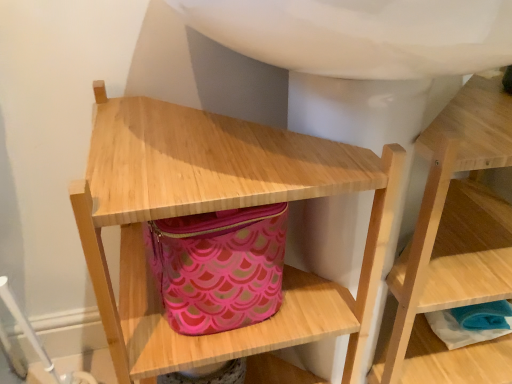
Question: Considering the relative positions of natural wood shelf at center, which ranks as the 1th shelf in left-to-right order, and wooden shelf at center, which appears as the first shelf when viewed from the right, in the image provided, is natural wood shelf at center, which ranks as the 1th shelf in left-to-right order, to the right of wooden shelf at center, which appears as the first shelf when viewed from the right, from the viewer's perspective?

Choices:
 (A) yes
 (B) no

Answer: (B)

Question: From a real-world perspective, is natural wood shelf at center, which appears as the 2th shelf when viewed from the right, over wooden shelf at center, positioned as the second shelf in left-to-right order?

Choices:
 (A) yes
 (B) no

Answer: (A)

Question: Does natural wood shelf at center, which ranks as the 1th shelf in left-to-right order, have a smaller size compared to wooden shelf at center, positioned as the second shelf in left-to-right order?

Choices:
 (A) no
 (B) yes

Answer: (A)

Question: From the image's perspective, is natural wood shelf at center, which appears as the 2th shelf when viewed from the right, on wooden shelf at center, which appears as the first shelf when viewed from the right?

Choices:
 (A) no
 (B) yes

Answer: (A)

Question: Are natural wood shelf at center, which appears as the 2th shelf when viewed from the right, and wooden shelf at center, positioned as the second shelf in left-to-right order, far apart?

Choices:
 (A) no
 (B) yes

Answer: (A)

Question: Is wooden shelf at center, which appears as the first shelf when viewed from the right, taller or shorter than natural wood shelf at center, which appears as the 2th shelf when viewed from the right?

Choices:
 (A) short
 (B) tall

Answer: (A)

Question: Looking at the image, does wooden shelf at center, positioned as the second shelf in left-to-right order, seem bigger or smaller compared to natural wood shelf at center, which appears as the 2th shelf when viewed from the right?

Choices:
 (A) small
 (B) big

Answer: (A)

Question: Considering the positions of point (392, 288) and point (360, 155), is point (392, 288) closer or farther from the camera than point (360, 155)?

Choices:
 (A) closer
 (B) farther

Answer: (B)

Question: Visually, is wooden shelf at center, positioned as the second shelf in left-to-right order, positioned to the left or to the right of natural wood shelf at center, which ranks as the 1th shelf in left-to-right order?

Choices:
 (A) left
 (B) right

Answer: (B)

Question: From the image's perspective, relative to pink fabric bag at center, is wooden shelf at center, positioned as the second shelf in left-to-right order, above or below?

Choices:
 (A) above
 (B) below

Answer: (B)

Question: Is wooden shelf at center, positioned as the second shelf in left-to-right order, situated inside pink fabric bag at center or outside?

Choices:
 (A) outside
 (B) inside

Answer: (A)

Question: From a real-world perspective, relative to pink fabric bag at center, is wooden shelf at center, which appears as the first shelf when viewed from the right, vertically above or below?

Choices:
 (A) below
 (B) above

Answer: (A)

Question: In terms of width, does wooden shelf at center, positioned as the second shelf in left-to-right order, look wider or thinner when compared to pink fabric bag at center?

Choices:
 (A) wide
 (B) thin

Answer: (A)

Question: Is point (180, 304) closer or farther from the camera than point (375, 382)?

Choices:
 (A) closer
 (B) farther

Answer: (A)

Question: In terms of width, does pink fabric bag at center look wider or thinner when compared to wooden shelf at center, which appears as the first shelf when viewed from the right?

Choices:
 (A) wide
 (B) thin

Answer: (B)